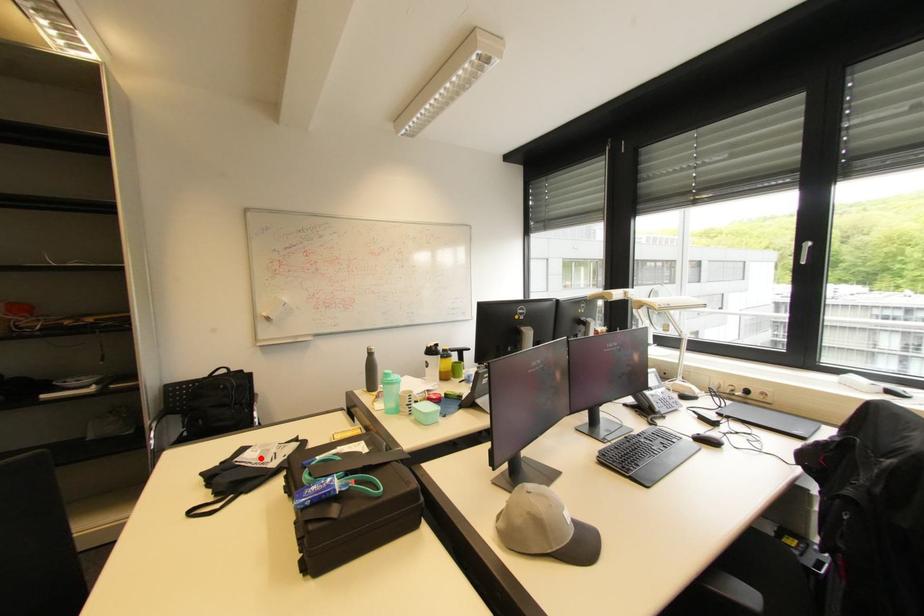
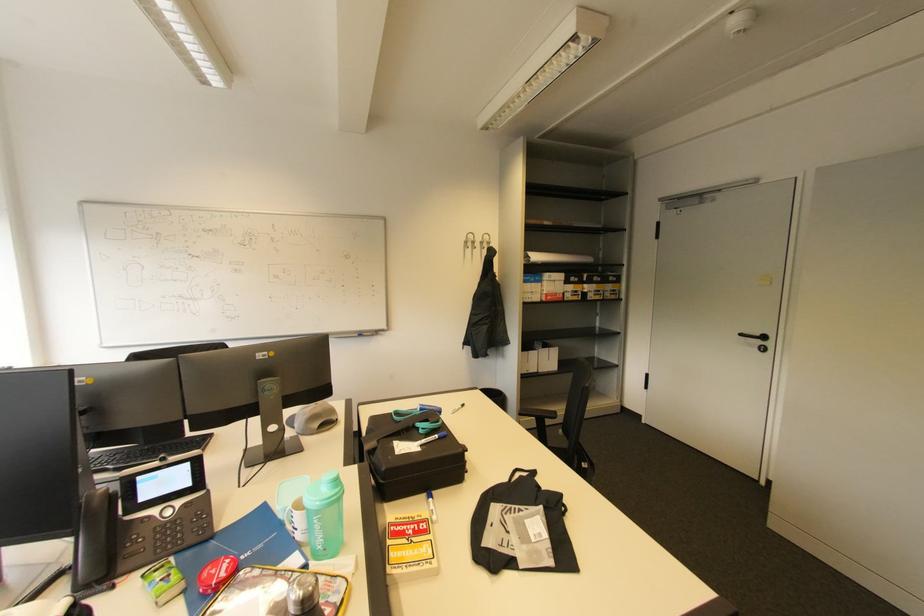
Where in the second image is the point corresponding to the highlighted location from the first image?

(531, 523)